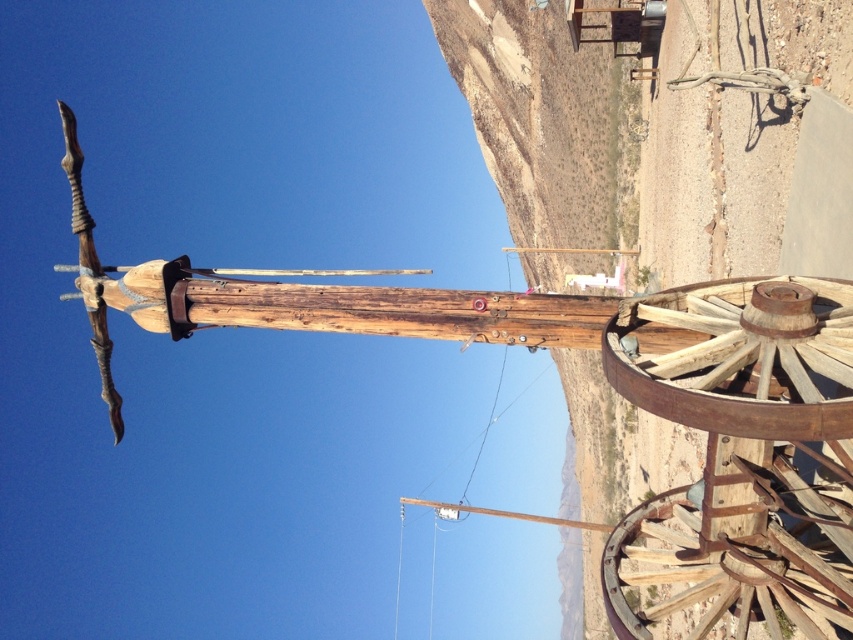
Question: Which point appears farthest from the camera in this image?

Choices:
 (A) (699, 342)
 (B) (666, 614)

Answer: (B)

Question: Considering the relative positions of rusty wood wagon wheel at lower right and rusty wood wagon wheel at right in the image provided, where is rusty wood wagon wheel at lower right located with respect to rusty wood wagon wheel at right?

Choices:
 (A) left
 (B) right

Answer: (B)

Question: Which point is farther from the camera taking this photo?

Choices:
 (A) (752, 579)
 (B) (636, 340)

Answer: (A)

Question: Is rusty wood wagon wheel at lower right to the left of rusty wood wagon wheel at right from the viewer's perspective?

Choices:
 (A) yes
 (B) no

Answer: (B)

Question: Which of the following is the farthest from the observer?

Choices:
 (A) rusty wood wagon wheel at right
 (B) rusty wood wagon wheel at lower right

Answer: (B)

Question: Does rusty wood wagon wheel at lower right come in front of rusty wood wagon wheel at right?

Choices:
 (A) no
 (B) yes

Answer: (A)